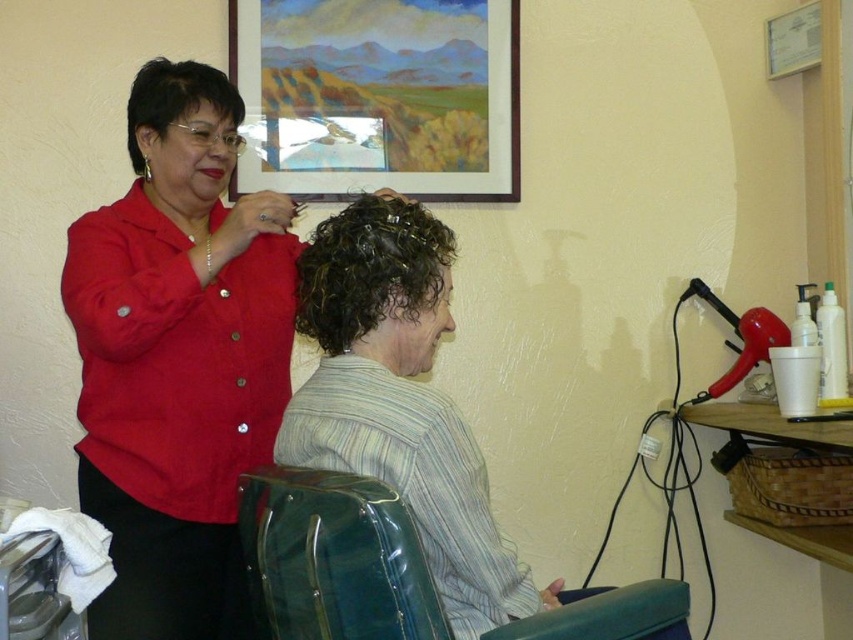
You are a customer in the salon and want to know if your striped fabric shirt at center is bigger than the matte black hair clip at upper left. Can you confirm?

The striped fabric shirt at center has a larger size compared to matte black hair clip at upper left, so yes, the shirt is bigger than the clip.

What is the location of the point with coordinates (376,97) in the image?

The point with coordinates (376,97) is located on the wooden framed painting at upper center.

Looking at this image, you are a customer in the salon and want to choose between the matte red blouse at upper left and the striped fabric shirt at center. Which one is closer to you?

The matte red blouse at upper left is closer to you since it is further to the viewer than the striped fabric shirt at center.